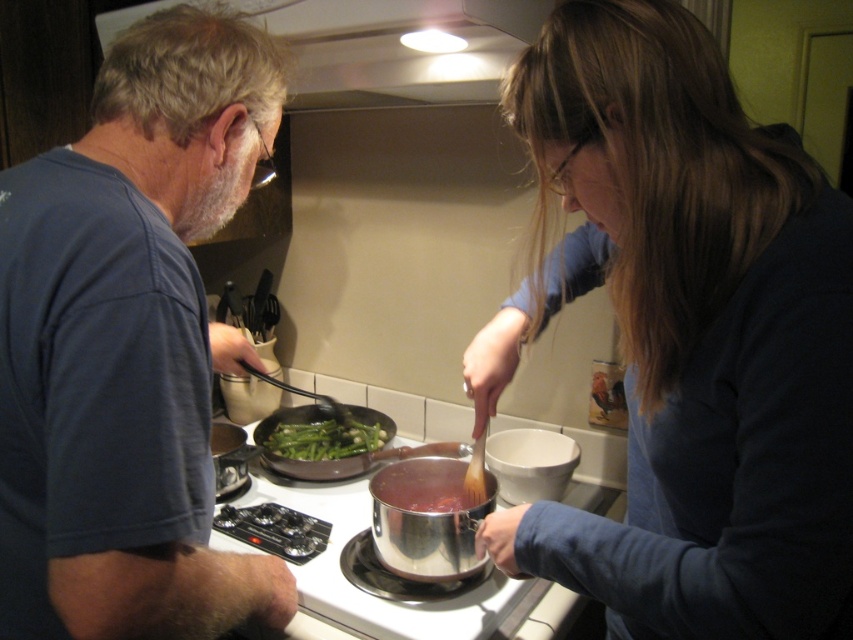
You are organizing a clothing donation drive and need to categorize shirts by size. You have a matte blue shirt at center and a blue cotton shirt at left. Which shirt should you place in the large size bin?

The matte blue shirt at center has a larger size compared to blue cotton shirt at left, so it should be placed in the large size bin.